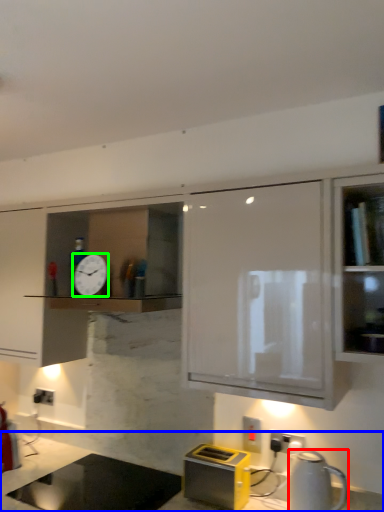
Question: Which object is the closest to the kitchen appliance (highlighted by a red box)? Choose among these: countertop (highlighted by a blue box) or clock (highlighted by a green box).

Choices:
 (A) countertop
 (B) clock

Answer: (B)